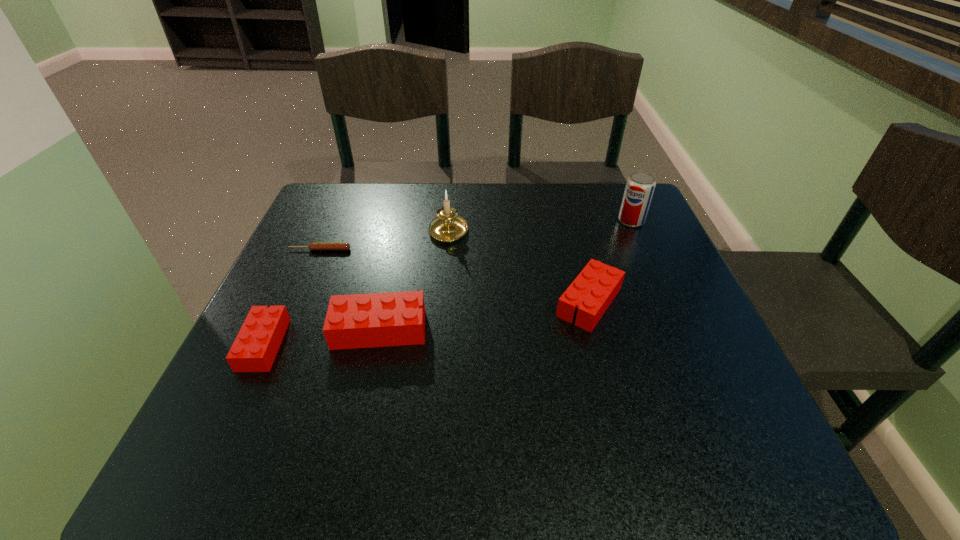
Identify the location of soda present at the right edge. The image size is (960, 540). (640, 185).

The image size is (960, 540). Find the location of `object situated at the far right corner`. object situated at the far right corner is located at coordinates (640, 185).

In the image, there is a desktop. Where is `vacant area at the far edge`? The width and height of the screenshot is (960, 540). vacant area at the far edge is located at coordinates (469, 194).

In the image, there is a desktop. Where is `vacant region at the near edge`? vacant region at the near edge is located at coordinates (396, 407).

Find the location of a particular element. Image resolution: width=960 pixels, height=540 pixels. vacant point at the left edge is located at coordinates (348, 284).

This screenshot has width=960, height=540. In the image, there is a desktop. What are the coordinates of `vacant area at the right edge` in the screenshot? It's located at (690, 323).

In the image, there is a desktop. Identify the location of vacant space at the far left corner. Image resolution: width=960 pixels, height=540 pixels. (339, 188).

This screenshot has height=540, width=960. Identify the location of vacant space at the near left corner. (292, 376).

Identify the location of vacant space at the far right corner of the desktop. This screenshot has width=960, height=540. (600, 184).

Identify the location of free space between the fourth tallest object and the sausage. (455, 276).